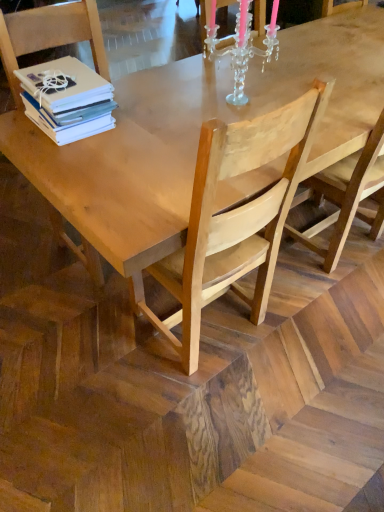
Question: Is white matte stack of books at upper left taller than light brown wood chair at left, which ranks as the 2th chair in right-to-left order?

Choices:
 (A) no
 (B) yes

Answer: (A)

Question: Is white matte stack of books at upper left shorter than light brown wood chair at left, which ranks as the 2th chair in right-to-left order?

Choices:
 (A) yes
 (B) no

Answer: (A)

Question: Is light brown wood chair at left, which ranks as the 2th chair in right-to-left order, at the back of white matte stack of books at upper left?

Choices:
 (A) no
 (B) yes

Answer: (B)

Question: Does white matte stack of books at upper left have a greater width compared to light brown wood chair at left, which ranks as the 2th chair in right-to-left order?

Choices:
 (A) yes
 (B) no

Answer: (B)

Question: Is white matte stack of books at upper left further to camera compared to light brown wood chair at left, arranged as the 1th chair when viewed from the left?

Choices:
 (A) yes
 (B) no

Answer: (A)

Question: From the image's perspective, is white matte stack of books at upper left located above or below light brown wooden chair at center, acting as the 2th chair starting from the left?

Choices:
 (A) above
 (B) below

Answer: (A)

Question: Is white matte stack of books at upper left spatially inside light brown wooden chair at center, acting as the 2th chair starting from the left, or outside of it?

Choices:
 (A) outside
 (B) inside

Answer: (A)

Question: Looking at their shapes, would you say white matte stack of books at upper left is wider or thinner than light brown wooden chair at center, acting as the 2th chair starting from the left?

Choices:
 (A) wide
 (B) thin

Answer: (B)

Question: Is point 84,74 positioned closer to the camera than point 261,286?

Choices:
 (A) closer
 (B) farther

Answer: (A)

Question: In the image, is light brown wood chair at left, which ranks as the 2th chair in right-to-left order, positioned in front of or behind clear crystal candle holder at upper center?

Choices:
 (A) behind
 (B) front

Answer: (B)

Question: Considering the positions of light brown wood chair at left, arranged as the 1th chair when viewed from the left, and clear crystal candle holder at upper center in the image, is light brown wood chair at left, arranged as the 1th chair when viewed from the left, wider or thinner than clear crystal candle holder at upper center?

Choices:
 (A) wide
 (B) thin

Answer: (A)

Question: Is light brown wood chair at left, arranged as the 1th chair when viewed from the left, taller or shorter than clear crystal candle holder at upper center?

Choices:
 (A) short
 (B) tall

Answer: (B)

Question: Would you say light brown wood chair at left, arranged as the 1th chair when viewed from the left, is to the left or to the right of clear crystal candle holder at upper center in the picture?

Choices:
 (A) right
 (B) left

Answer: (B)

Question: From the image's perspective, is white matte stack of books at upper left positioned above or below light brown wood chair at left, which ranks as the 2th chair in right-to-left order?

Choices:
 (A) above
 (B) below

Answer: (A)

Question: From a real-world perspective, is white matte stack of books at upper left positioned above or below light brown wood chair at left, which ranks as the 2th chair in right-to-left order?

Choices:
 (A) below
 (B) above

Answer: (B)